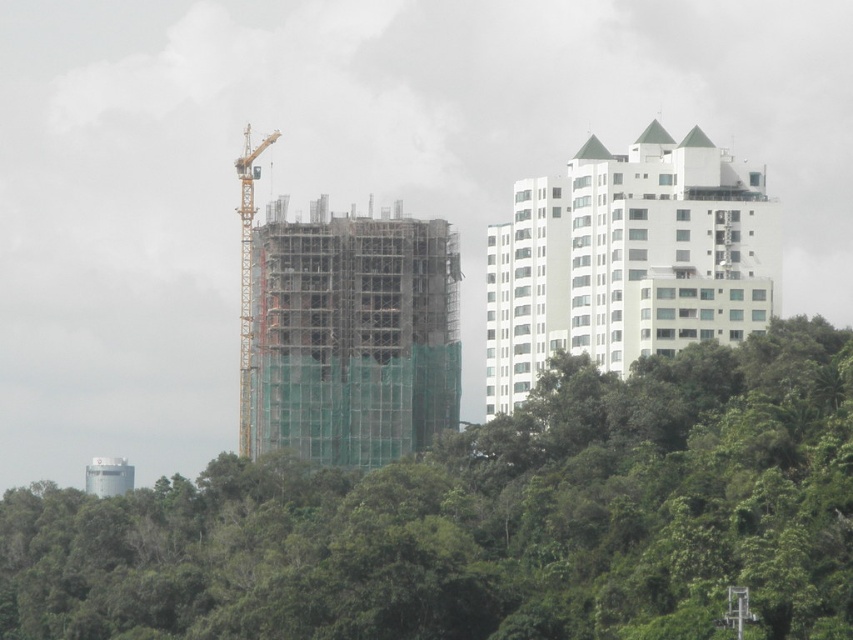
Which is behind, point (283, 385) or point (247, 346)?

The point (247, 346) is behind.

Can you confirm if scaffolding wood at center is positioned above yellow metallic crane at center-left?

No, scaffolding wood at center is not above yellow metallic crane at center-left.

Where is `scaffolding wood at center`? This screenshot has width=853, height=640. scaffolding wood at center is located at coordinates (352, 336).

Locate an element on the screen. scaffolding wood at center is located at coordinates 352,336.

Does white smooth building at upper right have a lesser width compared to scaffolding wood at center?

In fact, white smooth building at upper right might be wider than scaffolding wood at center.

Is white smooth building at upper right shorter than scaffolding wood at center?

No.

The width and height of the screenshot is (853, 640). Find the location of `white smooth building at upper right`. white smooth building at upper right is located at coordinates (628, 259).

Between green leafy trees at center and yellow metallic crane at center-left, which one appears on the left side from the viewer's perspective?

Positioned to the left is yellow metallic crane at center-left.

Which of these two, green leafy trees at center or yellow metallic crane at center-left, stands shorter?

With less height is green leafy trees at center.

Who is more distant from viewer, (444, 627) or (244, 420)?

The point (244, 420) is more distant.

Locate an element on the screen. green leafy trees at center is located at coordinates (488, 520).